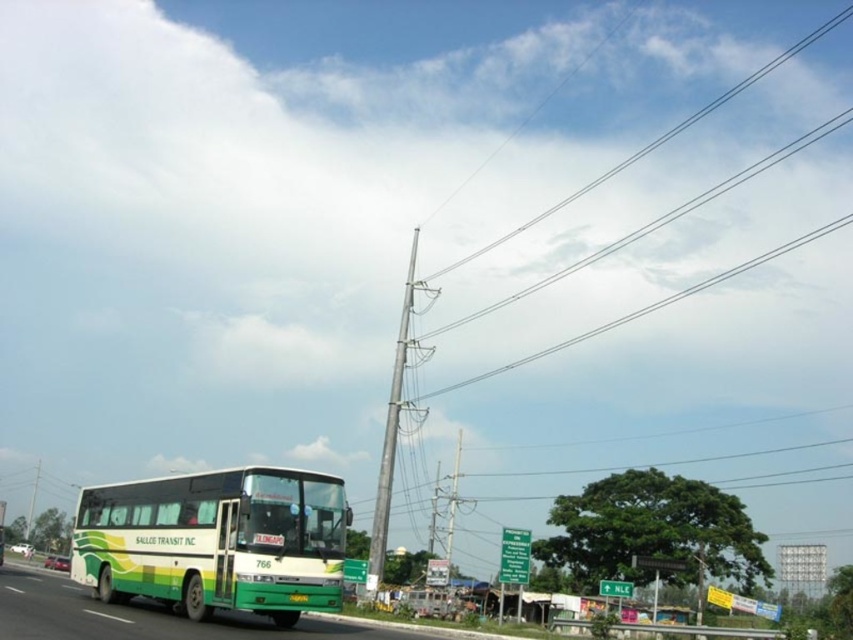
Question: Is green matte bus at center positioned behind silver metallic pole at upper center?

Choices:
 (A) yes
 (B) no

Answer: (B)

Question: Which point is farther to the camera?

Choices:
 (A) silver metallic pole at upper center
 (B) gray metallic pole at center
 (C) green matte bus at center

Answer: (A)

Question: Can you confirm if green matte bus at center is thinner than gray metallic pole at center?

Choices:
 (A) yes
 (B) no

Answer: (B)

Question: Among these points, which one is farthest from the camera?

Choices:
 (A) (312, 556)
 (B) (370, 568)
 (C) (722, 100)

Answer: (C)

Question: Considering the relative positions of green matte bus at lower left and gray metallic pole at center in the image provided, where is green matte bus at lower left located with respect to gray metallic pole at center?

Choices:
 (A) right
 (B) left

Answer: (B)

Question: Which point is farther to the camera?

Choices:
 (A) (27, 608)
 (B) (813, 131)
 (C) (370, 586)
 (D) (239, 532)

Answer: (B)